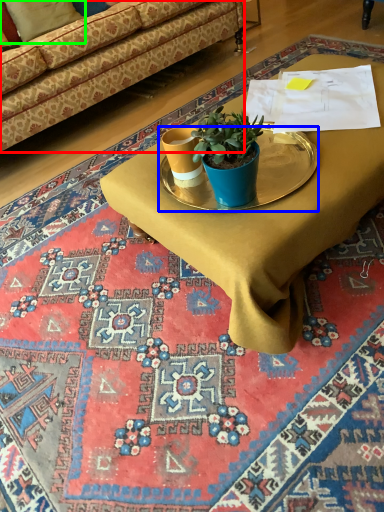
Question: Considering the real-world distances, which object is closest to studio couch (highlighted by a red box)? round table (highlighted by a blue box) or pillow (highlighted by a green box).

Choices:
 (A) round table
 (B) pillow

Answer: (B)